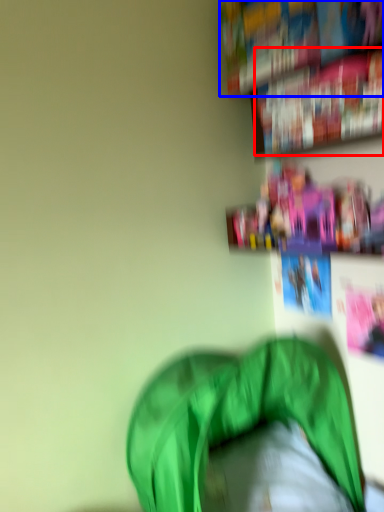
Question: Among these objects, which one is nearest to the camera, book (highlighted by a red box) or book (highlighted by a blue box)?

Choices:
 (A) book
 (B) book

Answer: (A)